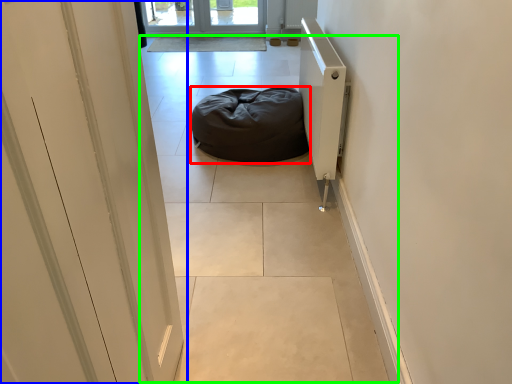
Question: Estimate the real-world distances between objects in this image. Which object is closer to furniture (highlighted by a red box), door (highlighted by a blue box) or path (highlighted by a green box)?

Choices:
 (A) door
 (B) path

Answer: (B)